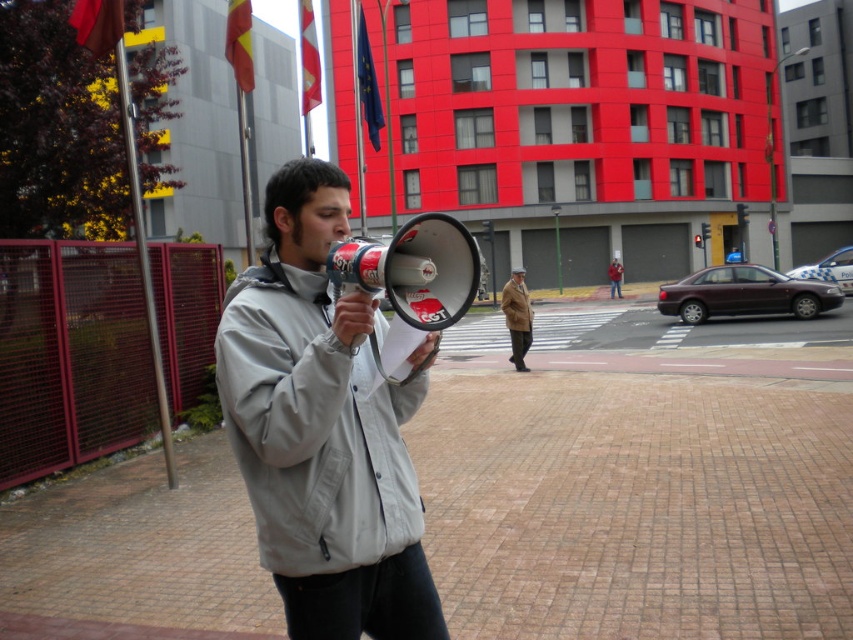
You are a photographer trying to capture a clear shot of both the light gray fabric jacket at center and the brown wool coat at center. Since both are at the center, which one will appear larger in your photo?

The light gray fabric jacket at center is closer to the viewer than the brown wool coat at center, so it will appear larger in the photo.

You are a fashion designer observing the urban scene. You notice the light gray fabric jacket at center and the brown wool coat at center. Which clothing item appears shorter in the image?

The light gray fabric jacket at center is not as tall as the brown wool coat at center, so the light gray fabric jacket at center appears shorter.